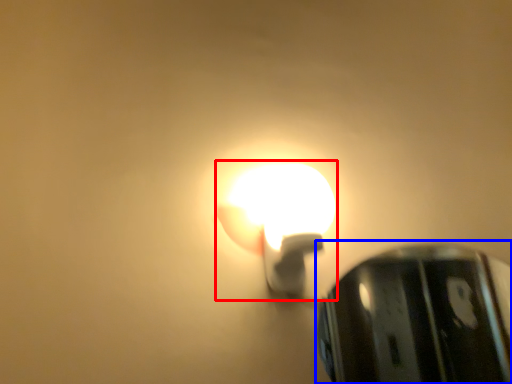
Question: Which object is closer to the camera taking this photo, lamp (highlighted by a red box) or lamp (highlighted by a blue box)?

Choices:
 (A) lamp
 (B) lamp

Answer: (A)